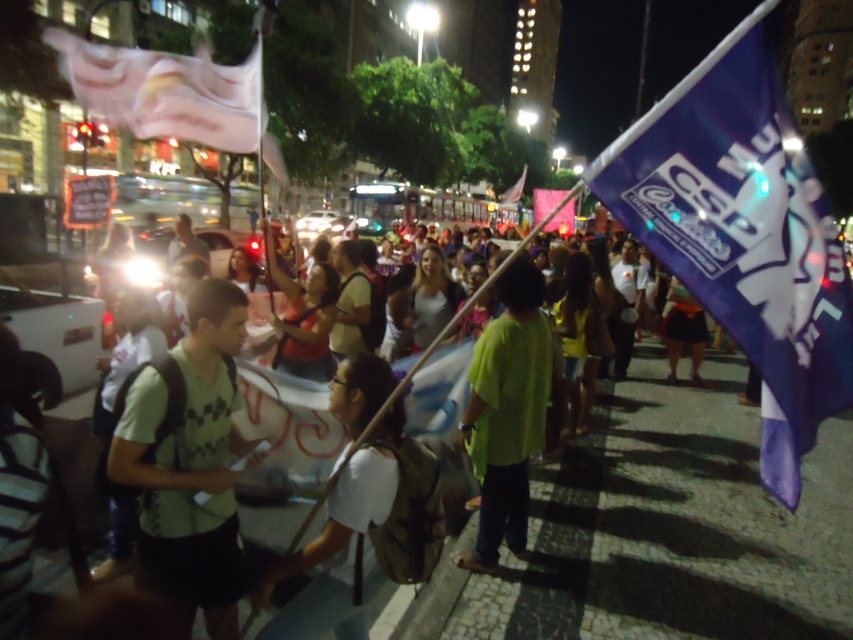
Who is higher up, purple fabric flag at right or green checkered shirt at left?

purple fabric flag at right is above.

From the picture: Can you confirm if purple fabric flag at right is shorter than green checkered shirt at left?

Correct, purple fabric flag at right is not as tall as green checkered shirt at left.

In order to click on purple fabric flag at right in this screenshot , I will do `click(744, 234)`.

Is green checkered shirt at left taller than green matte shirt at center?

No.

Measure the distance between point (x=235, y=314) and camera.

Point (x=235, y=314) and camera are 9.01 feet apart.

Which is behind, point (216, 570) or point (541, 374)?

Positioned behind is point (541, 374).

Image resolution: width=853 pixels, height=640 pixels. I want to click on green checkered shirt at left, so click(x=190, y=465).

Does white matte shirt at center have a smaller size compared to green matte shirt at center?

Correct, white matte shirt at center occupies less space than green matte shirt at center.

Between white matte shirt at center and green matte shirt at center, which one has less height?

With less height is white matte shirt at center.

This screenshot has width=853, height=640. I want to click on white matte shirt at center, so click(344, 512).